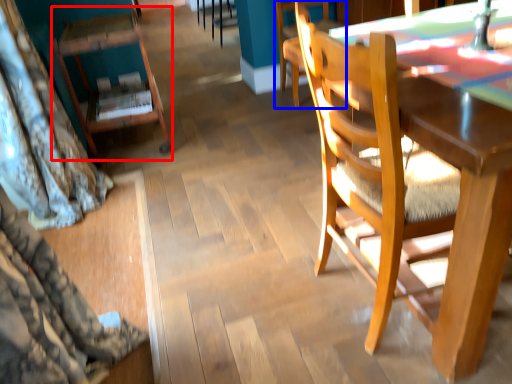
Question: Which point is further to the camera, chair (highlighted by a red box) or chair (highlighted by a blue box)?

Choices:
 (A) chair
 (B) chair

Answer: (B)